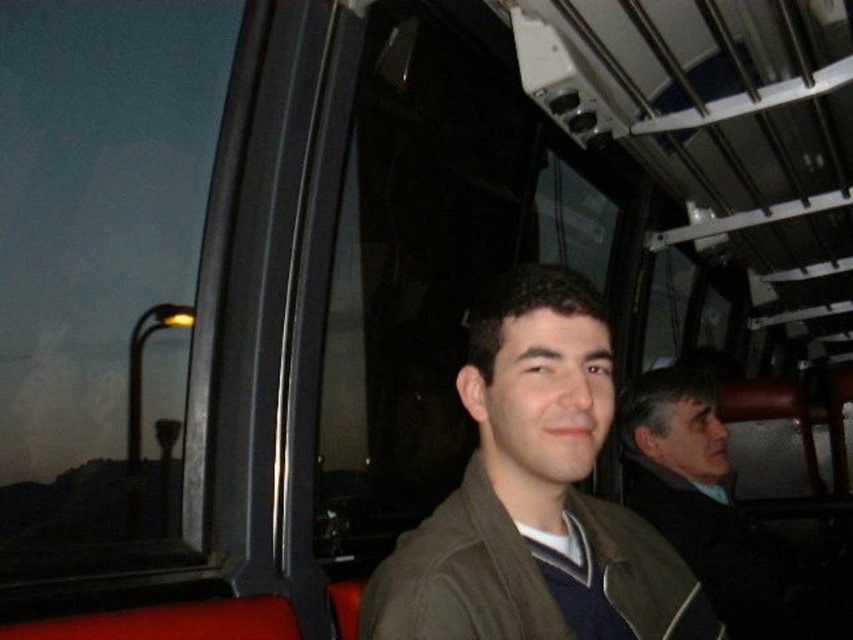
Question: Which point is farther to the camera?

Choices:
 (A) coord(714,394)
 (B) coord(549,291)

Answer: (A)

Question: Is matte brown jacket at center to the left of dark brown leather jacket at right from the viewer's perspective?

Choices:
 (A) no
 (B) yes

Answer: (B)

Question: Which point is farther from the camera taking this photo?

Choices:
 (A) (703, 612)
 (B) (737, 573)

Answer: (B)

Question: Is matte brown jacket at center thinner than dark brown leather jacket at right?

Choices:
 (A) yes
 (B) no

Answer: (B)

Question: Is matte brown jacket at center wider than dark brown leather jacket at right?

Choices:
 (A) yes
 (B) no

Answer: (A)

Question: Which object appears closest to the camera in this image?

Choices:
 (A) dark brown leather jacket at right
 (B) matte brown jacket at center

Answer: (B)